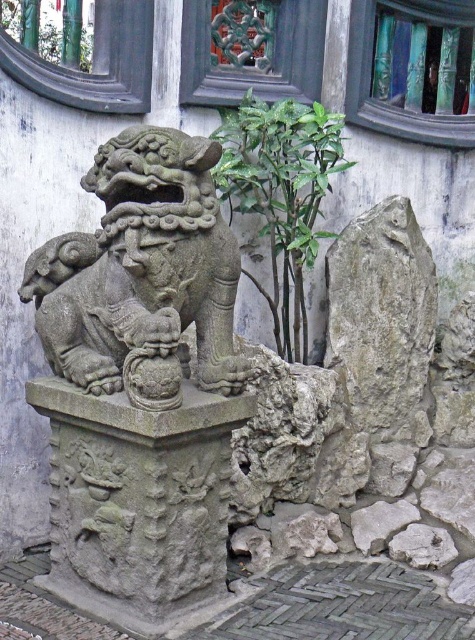
Question: Among these points, which one is nearest to the camera?

Choices:
 (A) (396, 349)
 (B) (211, 365)

Answer: (B)

Question: Which object is the closest to the gray rough rock at center?

Choices:
 (A) gray stone lion at center
 (B) gray stone pedestal at center
 (C) green leafy plant at center

Answer: (C)

Question: Does gray stone lion at center have a lesser width compared to green leafy plant at center?

Choices:
 (A) no
 (B) yes

Answer: (A)

Question: Does gray stone pedestal at center have a larger size compared to gray rough rock at center?

Choices:
 (A) yes
 (B) no

Answer: (A)

Question: Does gray rough rock at center have a lesser width compared to green leafy plant at center?

Choices:
 (A) no
 (B) yes

Answer: (B)

Question: Which of the following is the farthest from the observer?

Choices:
 (A) (208, 572)
 (B) (370, 387)

Answer: (B)